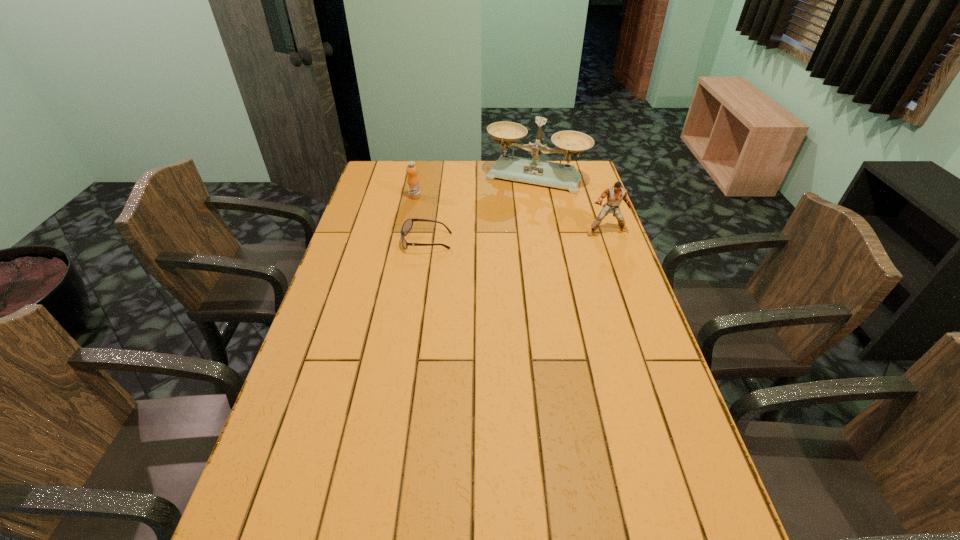
The height and width of the screenshot is (540, 960). What are the coordinates of `free space between the sunglasses and the second tallest object` in the screenshot? It's located at (516, 236).

The height and width of the screenshot is (540, 960). Find the location of `empty space that is in between the orange juice and the puncher`. empty space that is in between the orange juice and the puncher is located at coordinates (511, 214).

This screenshot has width=960, height=540. I want to click on object that stands as the closest to the third shortest object, so 534,171.

Where is `object that is the third closest to the second shortest object`? object that is the third closest to the second shortest object is located at coordinates (615, 195).